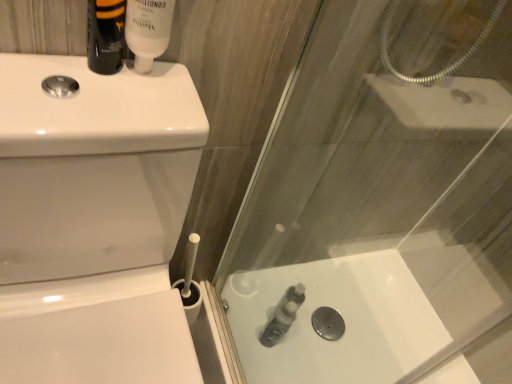
Image resolution: width=512 pixels, height=384 pixels. In order to click on vacant area that is in front of white glossy tube at upper center, arranged as the second toiletry when viewed from the right in this screenshot , I will do `click(92, 92)`.